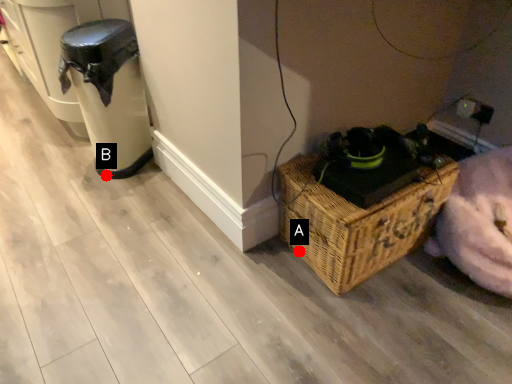
Question: Two points are circled on the image, labeled by A and B beside each circle. Among these points, which one is nearest to the camera?

Choices:
 (A) A is closer
 (B) B is closer

Answer: (A)